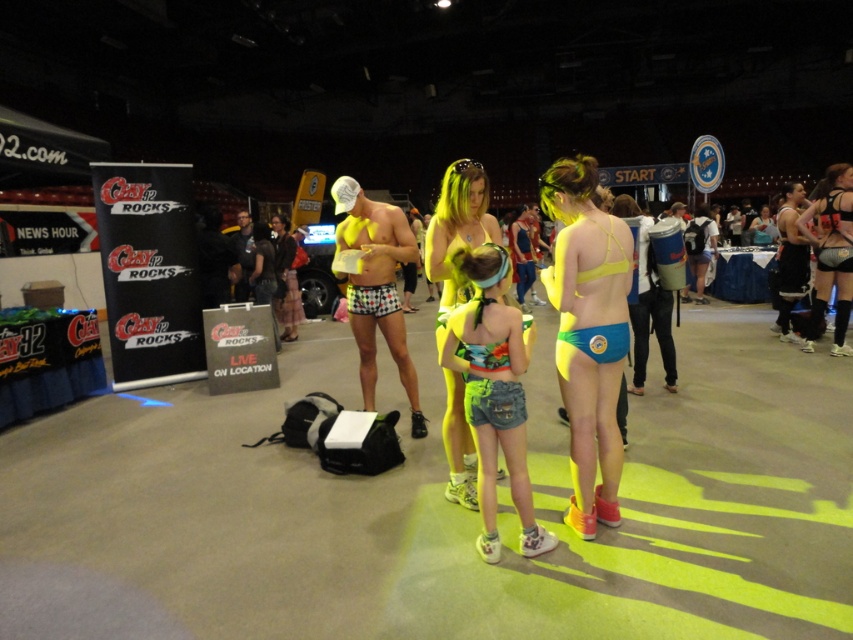
Does denim shorts at center have a lesser height compared to neon yellow fabric shorts at center?

Indeed, denim shorts at center has a lesser height compared to neon yellow fabric shorts at center.

Which is more to the right, denim shorts at center or neon yellow fabric shorts at center?

Positioned to the right is denim shorts at center.

Does point (500, 426) lie behind point (416, 412)?

No, (500, 426) is closer to viewer.

The image size is (853, 640). I want to click on denim shorts at center, so click(494, 390).

Between neon yellow bikini top at center and neon yellow fabric shorts at center, which one is positioned lower?

neon yellow bikini top at center

Is neon yellow bikini top at center taller than neon yellow fabric shorts at center?

Answer: Yes.

Which is in front, point (577, 353) or point (401, 257)?

Point (577, 353)

You are a GUI agent. You are given a task and a screenshot of the screen. Output one action in this format:
    pyautogui.click(x=<x>, y=<y>)
    Task: Click on the neon yellow bikini top at center
    The width and height of the screenshot is (853, 640).
    Given the screenshot: What is the action you would take?
    pos(589,333)

Can you confirm if neon yellow bikini top at center is positioned above denim shorts at center?

Yes.

Consider the image. Is neon yellow bikini top at center shorter than denim shorts at center?

In fact, neon yellow bikini top at center may be taller than denim shorts at center.

Locate an element on the screen. This screenshot has height=640, width=853. neon yellow bikini top at center is located at coordinates (589, 333).

The image size is (853, 640). I want to click on neon yellow bikini top at center, so click(589, 333).